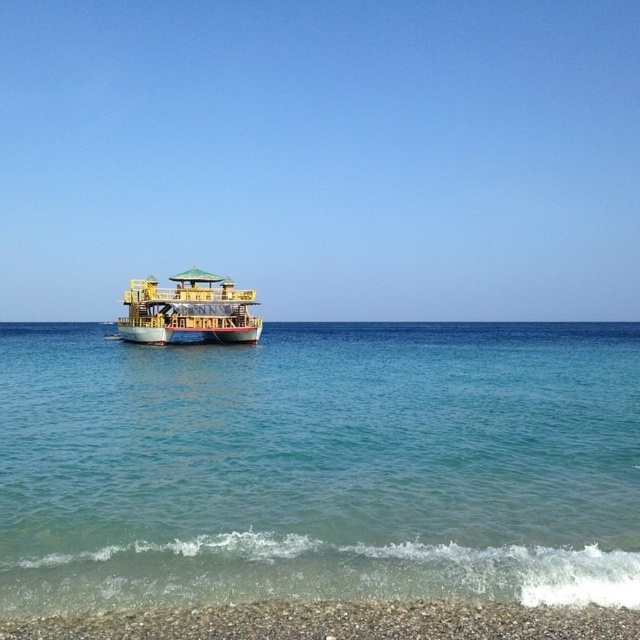
Question: Is clear blue water at center below yellow wooden boat at center?

Choices:
 (A) no
 (B) yes

Answer: (B)

Question: Is clear blue water at center thinner than yellow wooden boat at center?

Choices:
 (A) no
 (B) yes

Answer: (A)

Question: Can you confirm if clear blue water at center is bigger than yellow wooden boat at center?

Choices:
 (A) yes
 (B) no

Answer: (A)

Question: Among these points, which one is farthest from the camera?

Choices:
 (A) (602, 326)
 (B) (220, 312)

Answer: (A)

Question: Which point is closer to the camera taking this photo?

Choices:
 (A) (401, 464)
 (B) (163, 289)

Answer: (A)

Question: Which object is farther from the camera taking this photo?

Choices:
 (A) yellow wooden boat at center
 (B) clear blue water at center

Answer: (A)